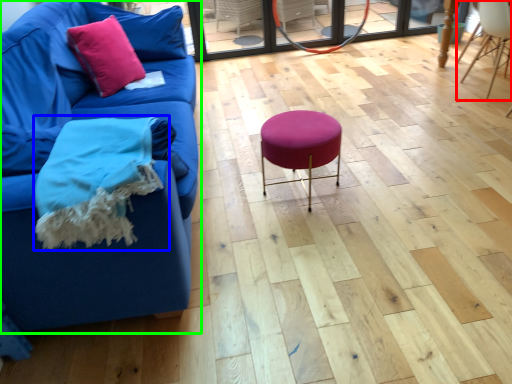
Question: Which object is the farthest from chair (highlighted by a red box)? Choose among these: blanket (highlighted by a blue box) or studio couch (highlighted by a green box).

Choices:
 (A) blanket
 (B) studio couch

Answer: (A)